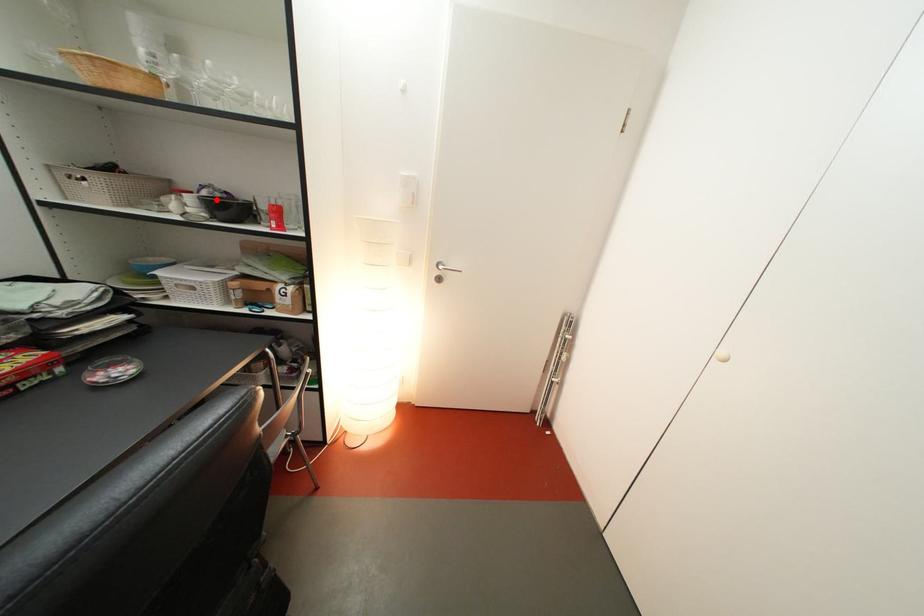
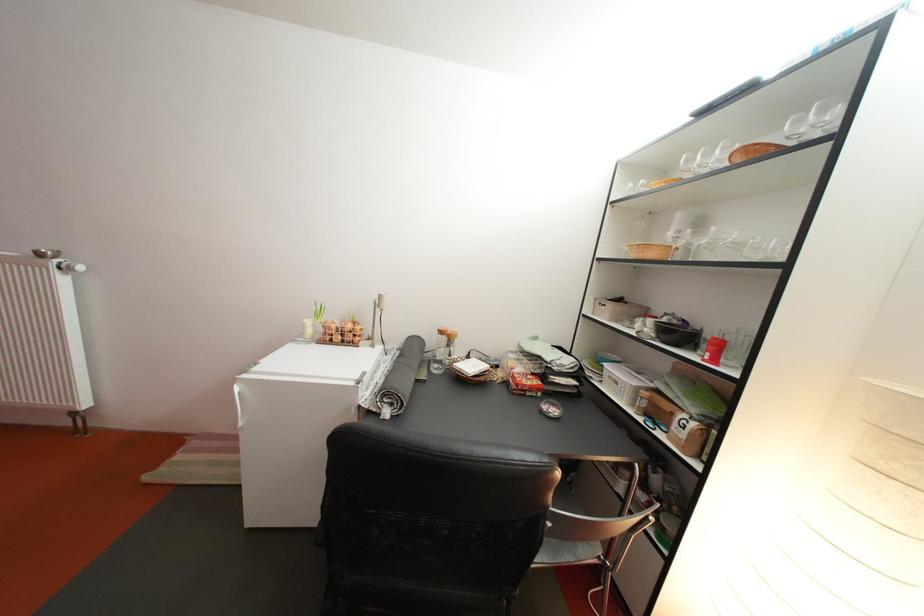
The point at the highlighted location is marked in the first image. Where is the corresponding point in the second image?

(675, 326)